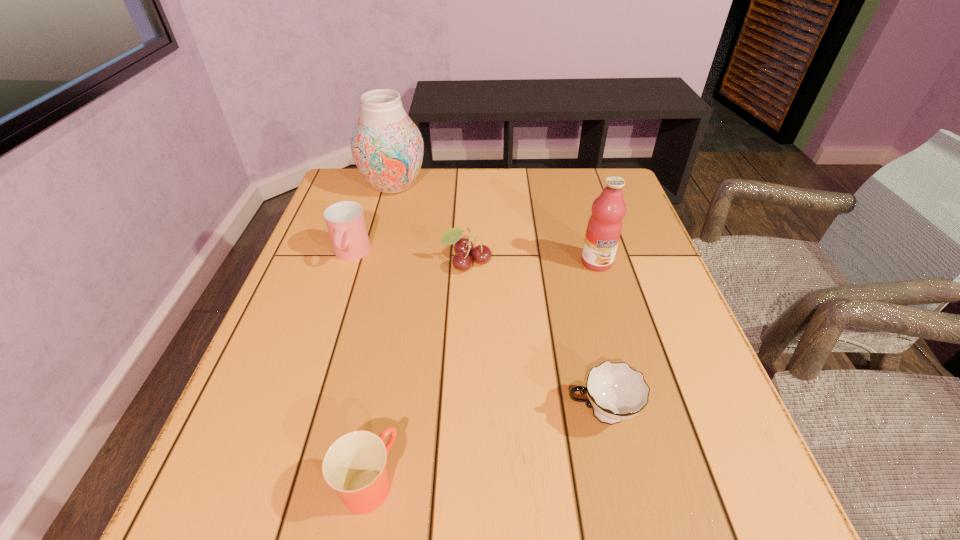
The image size is (960, 540). What are the coordinates of `free space between the nearest cup and the farthest cup` in the screenshot? It's located at (359, 368).

Locate an element on the screen. This screenshot has height=540, width=960. unoccupied area between the fifth shortest object and the third object from right to left is located at coordinates (532, 262).

Where is `free space between the cherry and the fruit juice`? This screenshot has width=960, height=540. free space between the cherry and the fruit juice is located at coordinates (532, 262).

Locate an element on the screen. This screenshot has height=540, width=960. vacant area between the tallest object and the third object from right to left is located at coordinates (430, 224).

This screenshot has width=960, height=540. I want to click on free space between the fruit juice and the rightmost cup, so click(599, 338).

This screenshot has height=540, width=960. Find the location of `vacant area between the farthest cup and the rightmost cup`. vacant area between the farthest cup and the rightmost cup is located at coordinates (476, 334).

This screenshot has width=960, height=540. What are the coordinates of `free spot between the second tallest object and the second nearest cup` in the screenshot? It's located at (599, 338).

Locate an element on the screen. free space between the cherry and the second nearest object is located at coordinates (534, 338).

The height and width of the screenshot is (540, 960). Identify the location of the closest object to the fifth shortest object. (481, 254).

Locate an element on the screen. Image resolution: width=960 pixels, height=540 pixels. object that is the third closest to the farthest cup is located at coordinates (354, 465).